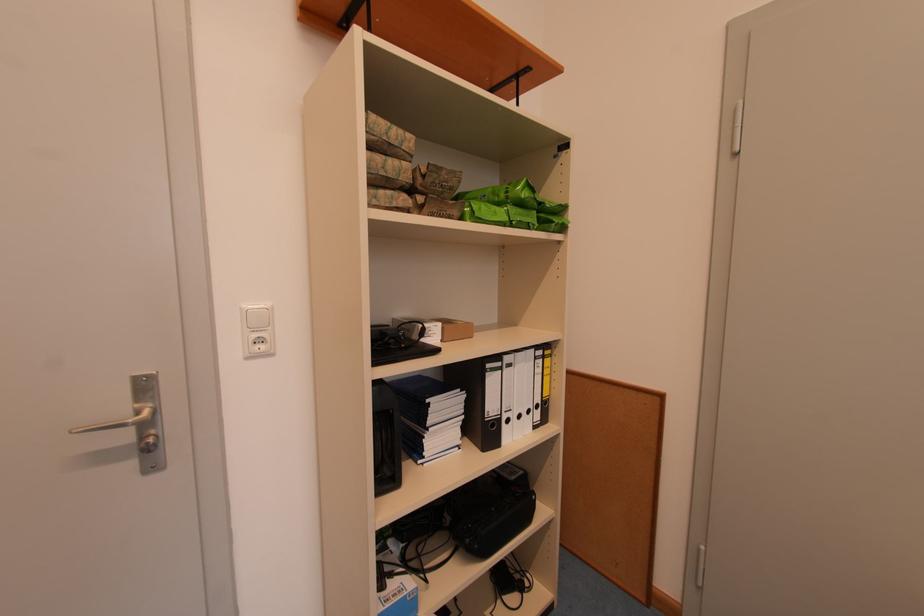
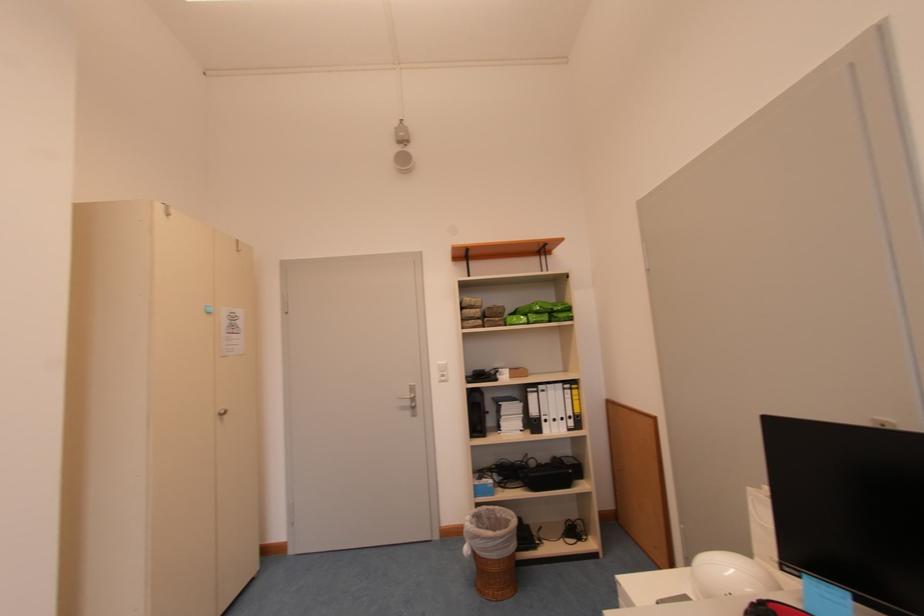
Find the pixel in the second image that matches (x=548, y=363) in the first image.

(576, 392)